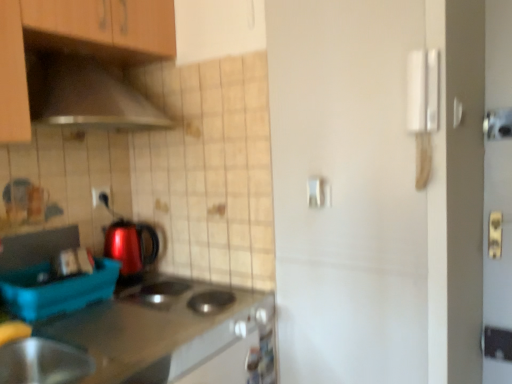
Question: Considering the relative sizes of metallic stainless steel bowl at lower left and white matte door handle at center, the first door handle when ordered from back to front, in the image provided, is metallic stainless steel bowl at lower left thinner than white matte door handle at center, the first door handle when ordered from back to front,?

Choices:
 (A) yes
 (B) no

Answer: (B)

Question: Can you confirm if metallic stainless steel bowl at lower left is shorter than white matte door handle at center, the 1th door handle when ordered from left to right?

Choices:
 (A) no
 (B) yes

Answer: (A)

Question: Does metallic stainless steel bowl at lower left have a larger size compared to white matte door handle at center, the 2th door handle positioned from the front?

Choices:
 (A) no
 (B) yes

Answer: (B)

Question: Is metallic stainless steel bowl at lower left positioned with its back to white matte door handle at center, the 2th door handle positioned from the front?

Choices:
 (A) no
 (B) yes

Answer: (A)

Question: Is metallic stainless steel bowl at lower left surrounding white matte door handle at center, the first door handle when ordered from back to front?

Choices:
 (A) no
 (B) yes

Answer: (A)

Question: From the image's perspective, is metallic stainless steel bowl at lower left under white matte door handle at center, the first door handle when ordered from back to front?

Choices:
 (A) yes
 (B) no

Answer: (A)

Question: Can you confirm if metallic stainless steel countertop at lower left is taller than blue plastic container at lower left?

Choices:
 (A) no
 (B) yes

Answer: (B)

Question: Is metallic stainless steel countertop at lower left bigger than blue plastic container at lower left?

Choices:
 (A) yes
 (B) no

Answer: (A)

Question: From the image's perspective, is metallic stainless steel countertop at lower left over blue plastic container at lower left?

Choices:
 (A) no
 (B) yes

Answer: (A)

Question: Is metallic stainless steel countertop at lower left next to blue plastic container at lower left and touching it?

Choices:
 (A) yes
 (B) no

Answer: (B)

Question: Is metallic stainless steel countertop at lower left at the left side of blue plastic container at lower left?

Choices:
 (A) yes
 (B) no

Answer: (B)

Question: Does metallic stainless steel countertop at lower left come behind blue plastic container at lower left?

Choices:
 (A) yes
 (B) no

Answer: (B)

Question: Is metallic stainless steel countertop at lower left looking in the opposite direction of matte black outlet at center?

Choices:
 (A) yes
 (B) no

Answer: (B)